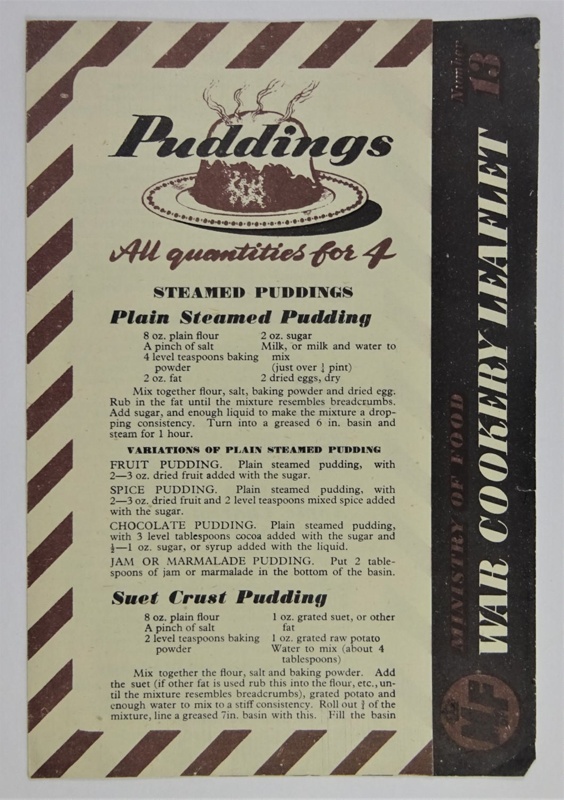
The width and height of the screenshot is (564, 800). Identify the location of basin. (386, 712).